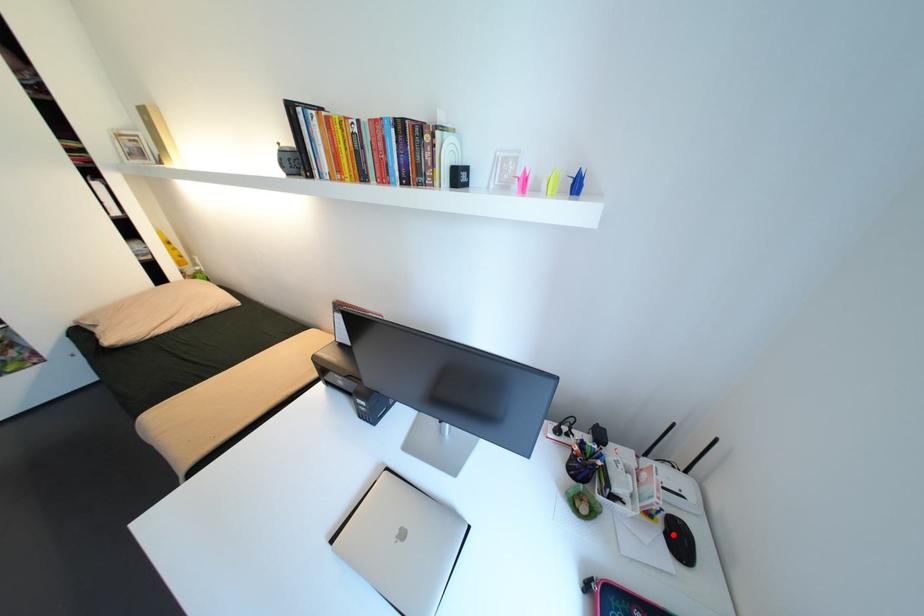
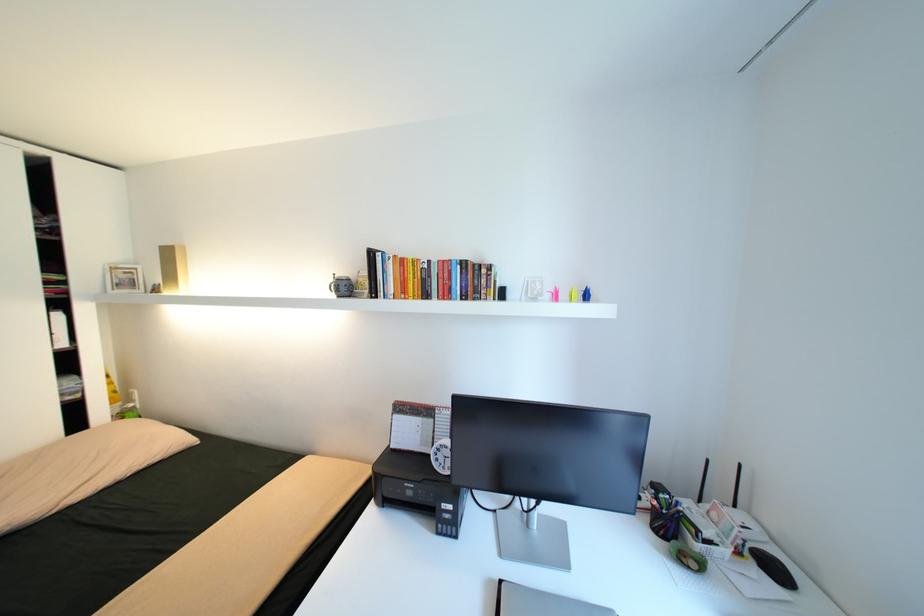
Find the pixel in the second image that matches the highlighted location in the first image.

(769, 567)